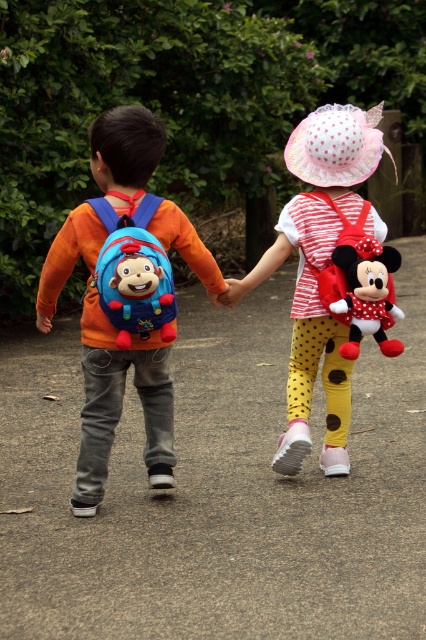
Question: Which object appears closest to the camera in this image?

Choices:
 (A) red plush minnie mouse at back
 (B) polka dot fabric dress at center

Answer: (A)

Question: Which point is closer to the camera?

Choices:
 (A) red plush minnie mouse at back
 (B) matte blue backpack at left

Answer: (B)

Question: Which of these objects is positioned farthest from the red plush minnie mouse at back?

Choices:
 (A) polka dot fabric dress at center
 (B) matte blue backpack at left
 (C) matte blue fabric backpack at left

Answer: (C)

Question: Can you confirm if matte blue backpack at left is wider than matte blue fabric backpack at left?

Choices:
 (A) no
 (B) yes

Answer: (B)

Question: Is matte blue backpack at left closer to the viewer compared to polka dot fabric dress at center?

Choices:
 (A) yes
 (B) no

Answer: (A)

Question: Does matte blue backpack at left appear on the right side of polka dot fabric dress at center?

Choices:
 (A) yes
 (B) no

Answer: (B)